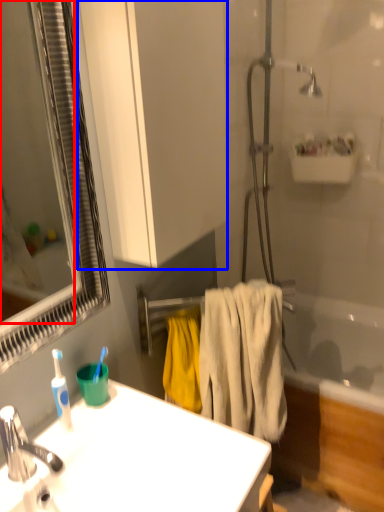
Question: Which object appears farthest to the camera in this image, mirror (highlighted by a red box) or bathroom cabinet (highlighted by a blue box)?

Choices:
 (A) mirror
 (B) bathroom cabinet

Answer: (B)